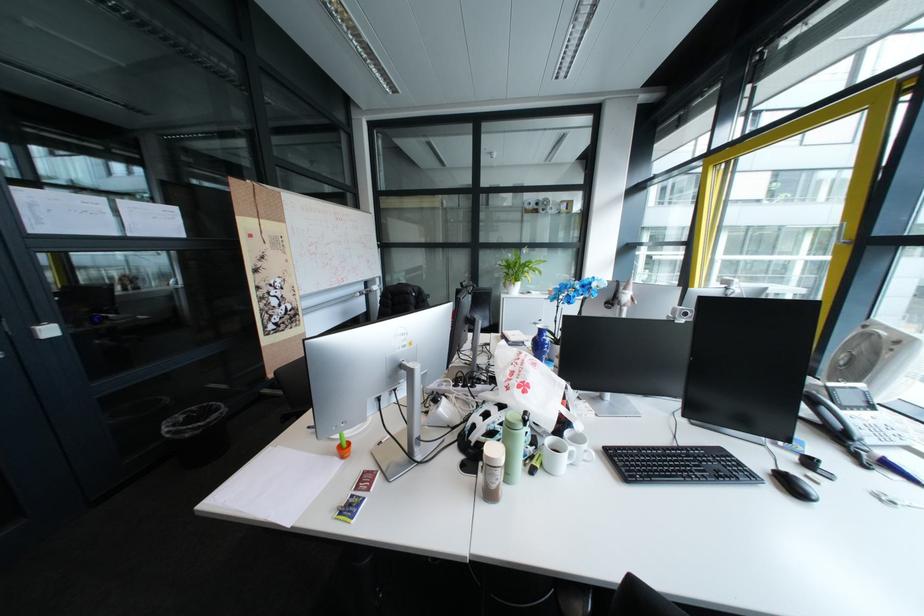
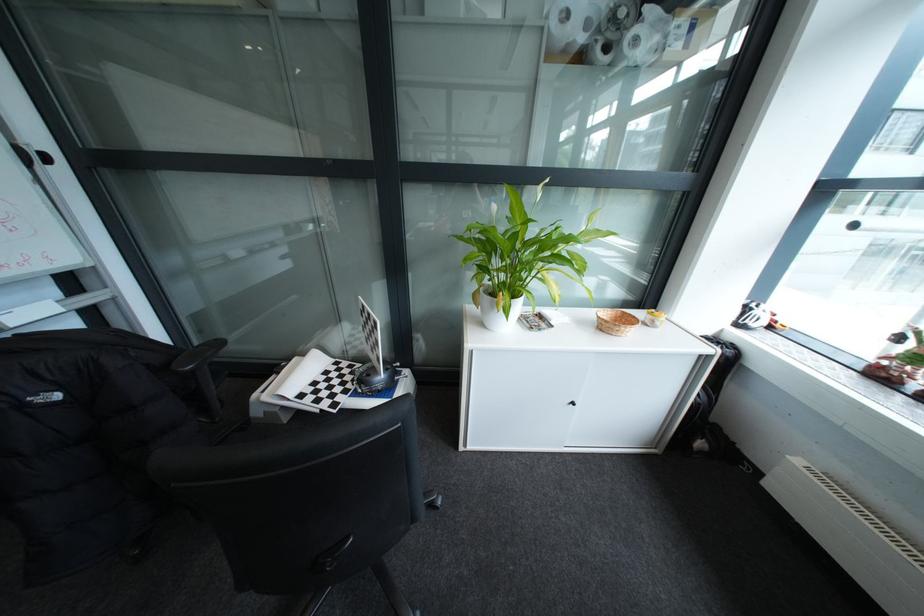
Question: What movement of the cameraman would produce the second image?

Choices:
 (A) Left
 (B) Right
 (C) Forward
 (D) Backward

Answer: (C)